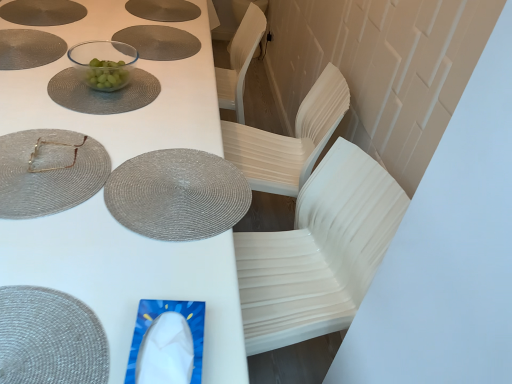
Image resolution: width=512 pixels, height=384 pixels. I want to click on vacant space situated on the left part of clear glass bowl at upper center, which appears as the fourth tableware when viewed from the front, so click(x=46, y=71).